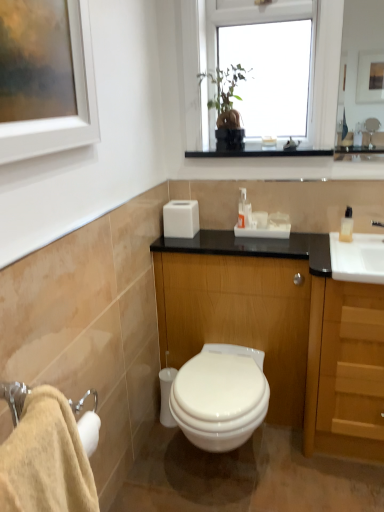
Question: Is transparent glass window at upper center at the back of white glossy toilet at center?

Choices:
 (A) no
 (B) yes

Answer: (A)

Question: From the image's perspective, is white glossy toilet at center on top of transparent glass window at upper center?

Choices:
 (A) yes
 (B) no

Answer: (B)

Question: Does white glossy toilet at center have a larger size compared to transparent glass window at upper center?

Choices:
 (A) yes
 (B) no

Answer: (A)

Question: Can you confirm if white glossy toilet at center is smaller than transparent glass window at upper center?

Choices:
 (A) yes
 (B) no

Answer: (B)

Question: Is white glossy toilet at center outside transparent glass window at upper center?

Choices:
 (A) no
 (B) yes

Answer: (B)

Question: From a real-world perspective, is white glossy toilet at center positioned above or below white plastic soap dispenser at center?

Choices:
 (A) below
 (B) above

Answer: (A)

Question: From the image's perspective, relative to white plastic soap dispenser at center, is white glossy toilet at center above or below?

Choices:
 (A) below
 (B) above

Answer: (A)

Question: Is point (216, 430) closer or farther from the camera than point (238, 217)?

Choices:
 (A) closer
 (B) farther

Answer: (A)

Question: Is white glossy toilet at center wider or thinner than white plastic soap dispenser at center?

Choices:
 (A) thin
 (B) wide

Answer: (B)

Question: From a real-world perspective, is wooden cabinet at center positioned above or below beige cotton bath towel at lower left?

Choices:
 (A) below
 (B) above

Answer: (A)

Question: Is wooden cabinet at center taller or shorter than beige cotton bath towel at lower left?

Choices:
 (A) tall
 (B) short

Answer: (A)

Question: Is wooden cabinet at center wider or thinner than beige cotton bath towel at lower left?

Choices:
 (A) thin
 (B) wide

Answer: (B)

Question: Is point (370, 394) positioned closer to the camera than point (94, 506)?

Choices:
 (A) farther
 (B) closer

Answer: (A)

Question: From the image's perspective, relative to white glossy toilet at center, is wooden cabinet at center above or below?

Choices:
 (A) below
 (B) above

Answer: (B)

Question: Would you say wooden cabinet at center is inside or outside white glossy toilet at center?

Choices:
 (A) outside
 (B) inside

Answer: (A)